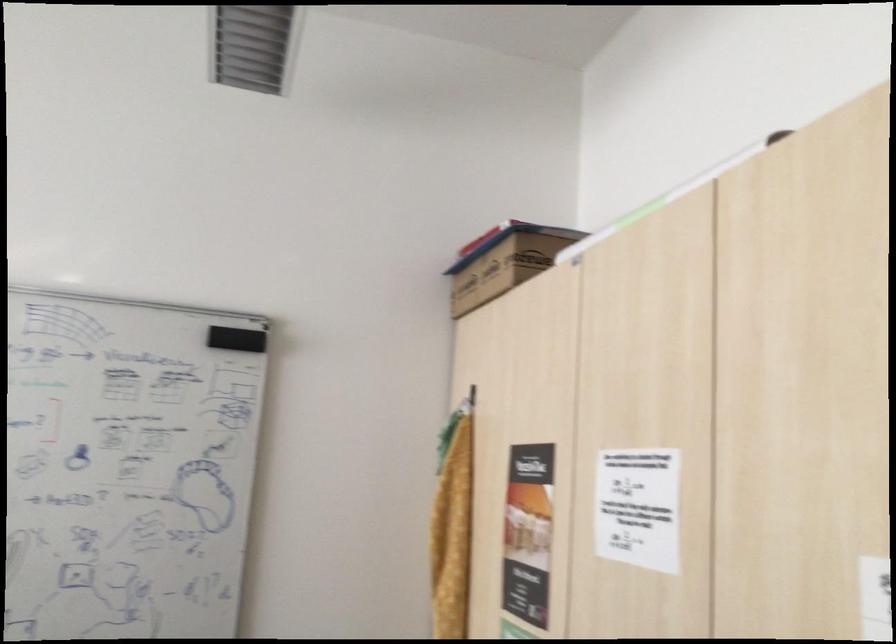
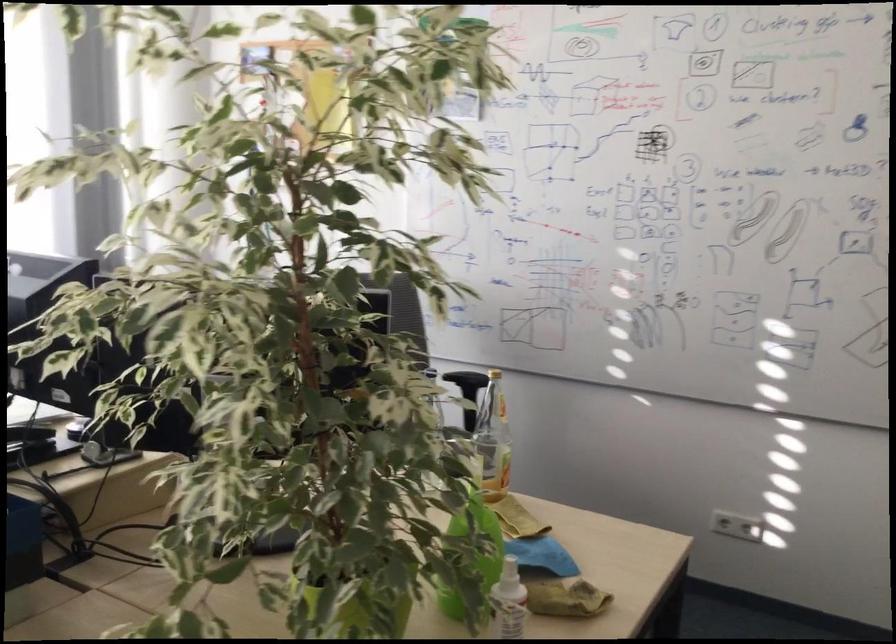
Question: Based on the continuous images, in which direction is the camera rotating? Reply with the corresponding letter.

Choices:
 (A) Left
 (B) Right
 (C) Up
 (D) Down

Answer: (A)